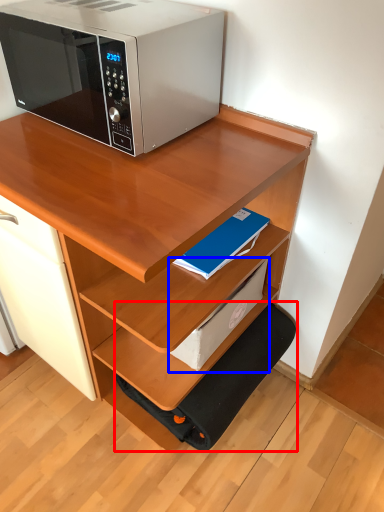
Question: Which object appears farthest to the camera in this image, step stool (highlighted by a red box) or paperback book (highlighted by a blue box)?

Choices:
 (A) step stool
 (B) paperback book

Answer: (A)